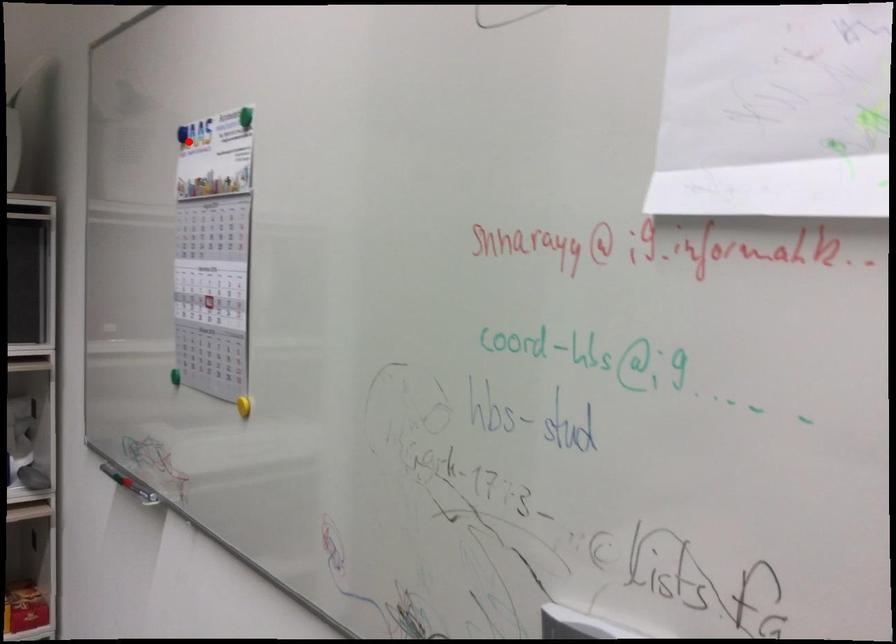
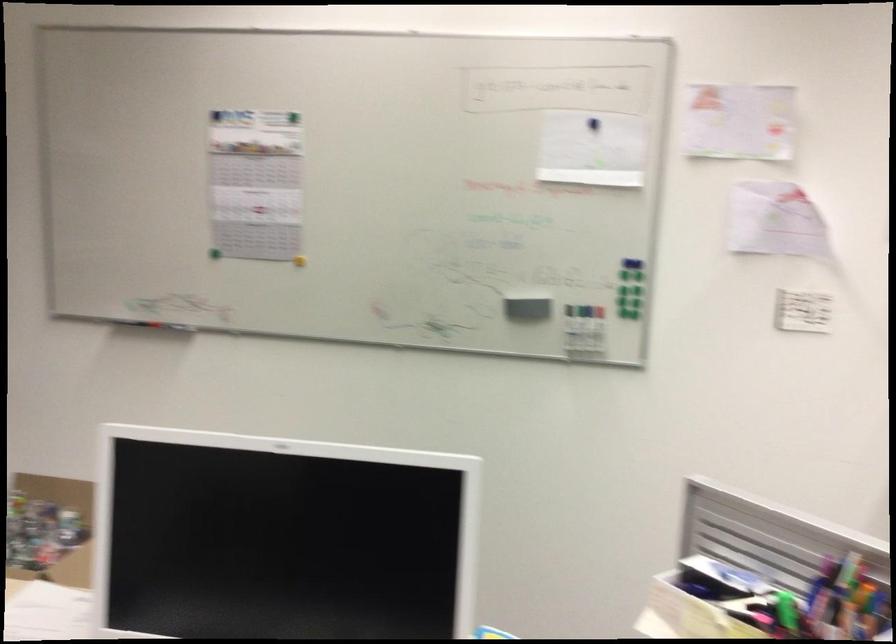
Question: A red point is marked in image1. In image2, is the corresponding 3D point closer to the camera or farther? Reply with the corresponding letter.

Choices:
 (A) The corresponding 3D point is closer.
 (B) The corresponding 3D point is farther.

Answer: (B)